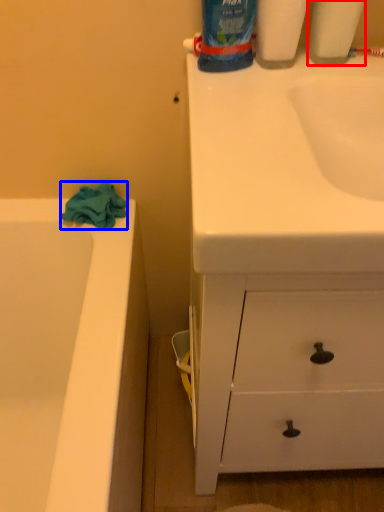
Question: Which of the following is the closest to the observer, cleaning product (highlighted by a red box) or bath towel (highlighted by a blue box)?

Choices:
 (A) cleaning product
 (B) bath towel

Answer: (A)